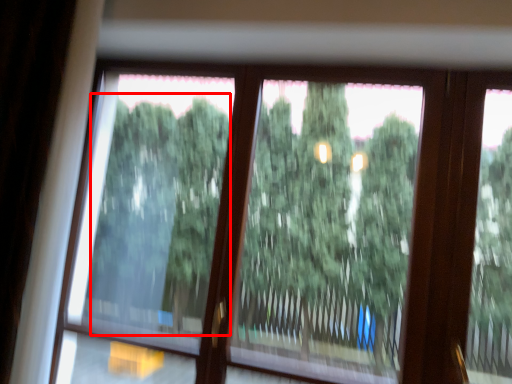
Question: Observing the image, what is the correct spatial positioning of tree (annotated by the red box) in reference to tree?

Choices:
 (A) left
 (B) right

Answer: (A)